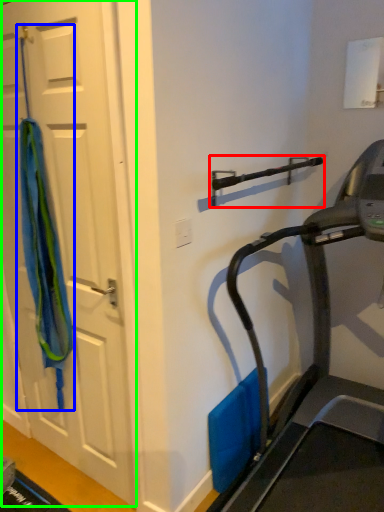
Question: Based on their relative distances, which object is farther from door handle (highlighted by a red box)? Choose from curtain (highlighted by a blue box) and door (highlighted by a green box).

Choices:
 (A) curtain
 (B) door

Answer: (A)